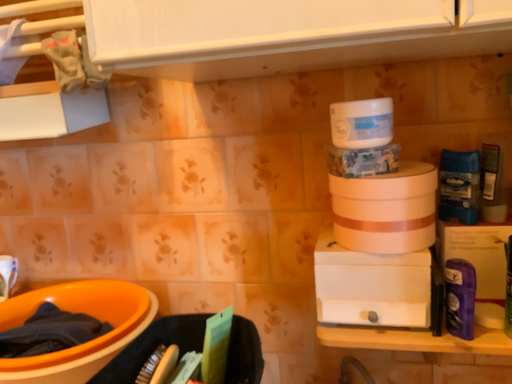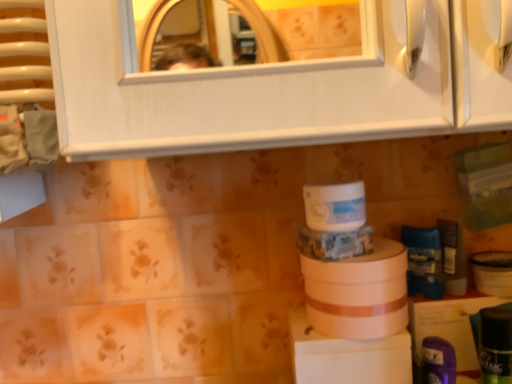
Question: How did the camera likely rotate when shooting the video?

Choices:
 (A) rotated left
 (B) rotated right

Answer: (B)